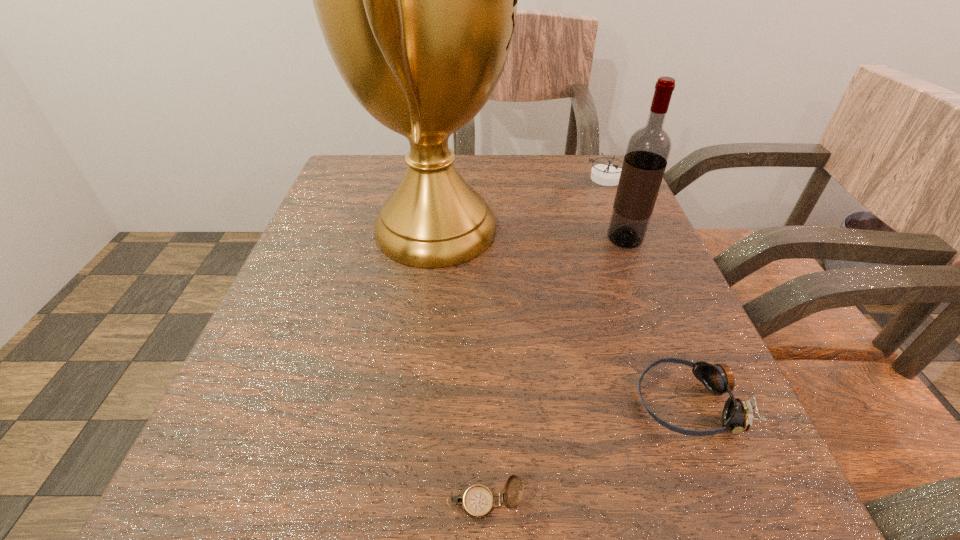
Find the location of `the tallest object`. the tallest object is located at coordinates point(416,0).

The width and height of the screenshot is (960, 540). I want to click on wine bottle, so click(x=648, y=149).

Identify the location of the farther compass. The image size is (960, 540). (604, 174).

I want to click on goggles, so click(x=738, y=414).

Where is `the nearest object`? The height and width of the screenshot is (540, 960). the nearest object is located at coordinates (478, 501).

Locate an element on the screen. the left compass is located at coordinates (478, 501).

The image size is (960, 540). Find the location of `free spot located on the surface of the tallest object with symbols`. free spot located on the surface of the tallest object with symbols is located at coordinates (569, 230).

Locate an element on the screen. The image size is (960, 540). blank space located on the back of the wine bottle is located at coordinates (614, 214).

Identify the location of vacant position located 0.160m on the left of the farther compass. (517, 177).

Find the location of a particular element. Image resolution: width=960 pixels, height=540 pixels. blank space located 0.210m through the lenses of the second nearest object is located at coordinates (476, 403).